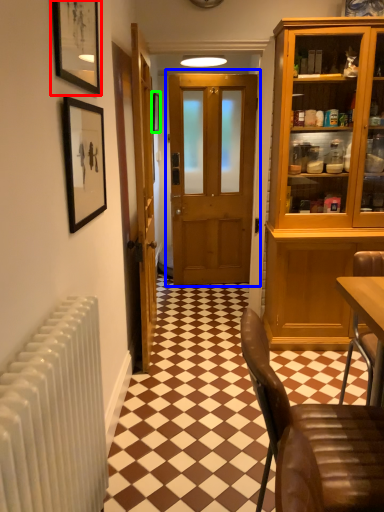
Question: Estimate the real-world distances between objects in this image. Which object is farther from picture frame (highlighted by a red box), door (highlighted by a blue box) or picture frame (highlighted by a green box)?

Choices:
 (A) door
 (B) picture frame

Answer: (B)